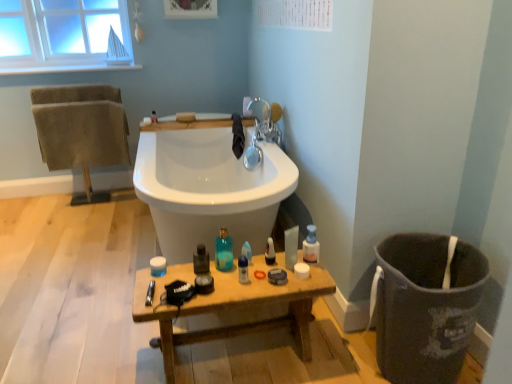
Find the location of a particular element. free spot to the right of blue glossy bottle at center, which is the 1th mouthwash in right-to-left order is located at coordinates (277, 276).